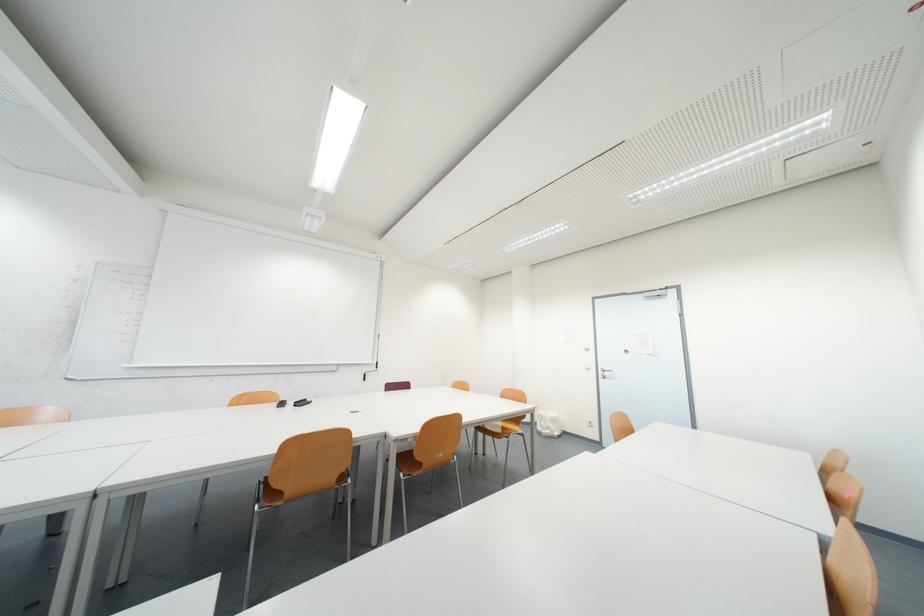
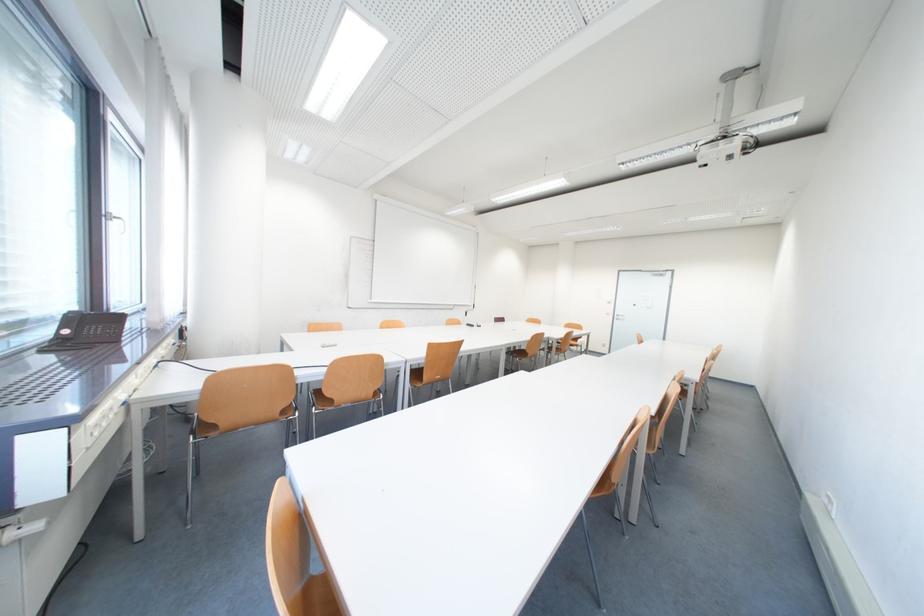
Which direction would the cameraman need to move to produce the second image?

The movement direction of the cameraman is left, backward.